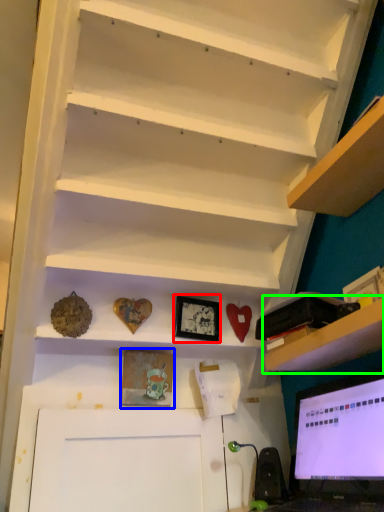
Question: Which object is the closest to the picture frame (highlighted by a red box)? Choose among these: picture frame (highlighted by a blue box) or shelf (highlighted by a green box).

Choices:
 (A) picture frame
 (B) shelf

Answer: (A)